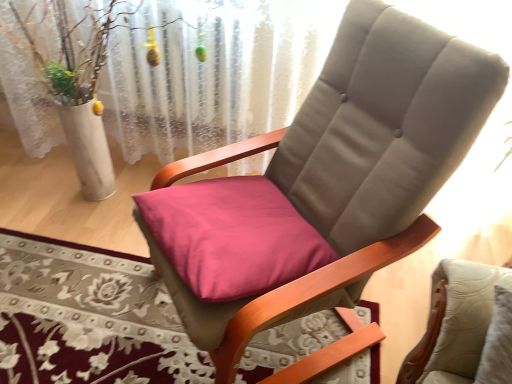
Where is `vacant point to the left of white lace curtain at upper center`? vacant point to the left of white lace curtain at upper center is located at coordinates (46, 211).